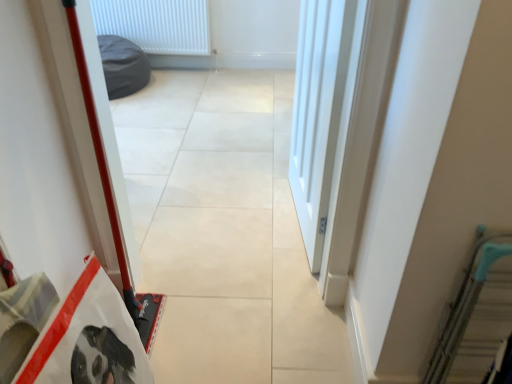
Question: Considering the relative positions of teal metallic escalator at right and beige tile floor at center in the image provided, is teal metallic escalator at right to the left or to the right of beige tile floor at center?

Choices:
 (A) right
 (B) left

Answer: (A)

Question: Is point (473, 311) closer or farther from the camera than point (193, 110)?

Choices:
 (A) farther
 (B) closer

Answer: (B)

Question: Estimate the real-world distances between objects in this image. Which object is closer to the teal metallic escalator at right?

Choices:
 (A) white plastic radiator at upper center
 (B) white smooth door at center
 (C) beige tile floor at center

Answer: (B)

Question: Which of these objects is positioned closest to the white smooth door at center?

Choices:
 (A) white plastic radiator at upper center
 (B) teal metallic escalator at right
 (C) beige tile floor at center

Answer: (C)